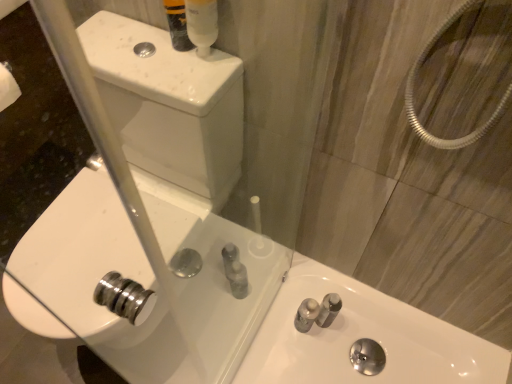
Find the location of `white glossy sink at lower right, the 2th sink when ordered from left to right`. white glossy sink at lower right, the 2th sink when ordered from left to right is located at coordinates (362, 337).

Which object is closer to the camera taking this photo, translucent plastic tube at upper center or translucent plastic mouthwash at upper center?

Positioned in front is translucent plastic mouthwash at upper center.

Are translucent plastic tube at upper center and translucent plastic mouthwash at upper center making contact?

Yes, the surface of translucent plastic tube at upper center is in contact with translucent plastic mouthwash at upper center.

Can you tell me how much translucent plastic tube at upper center and translucent plastic mouthwash at upper center differ in facing direction?

translucent plastic tube at upper center and translucent plastic mouthwash at upper center are facing 35.9 degrees away from each other.

Is translucent plastic tube at upper center aimed at translucent plastic mouthwash at upper center?

Yes, translucent plastic tube at upper center is facing translucent plastic mouthwash at upper center.

From the image's perspective, would you say translucent plastic tube at upper center is shown under white glossy sink at lower right, the 2th sink when ordered from left to right?

No.

Is white glossy sink at lower right, the first sink positioned from the right, at the back of translucent plastic tube at upper center?

No, translucent plastic tube at upper center's orientation is not away from white glossy sink at lower right, the first sink positioned from the right.

In terms of size, does translucent plastic tube at upper center appear bigger or smaller than white glossy sink at lower right, the first sink positioned from the right?

Considering their sizes, translucent plastic tube at upper center takes up less space than white glossy sink at lower right, the first sink positioned from the right.

In the image, is translucent plastic tube at upper center positioned in front of or behind white glossy sink at lower right, the first sink positioned from the right?

In the image, translucent plastic tube at upper center appears in front of white glossy sink at lower right, the first sink positioned from the right.

Measure the distance from translucent plastic mouthwash at upper center to translucent plastic tube at upper center.

They are 1.92 inches apart.

Which is in front, translucent plastic mouthwash at upper center or translucent plastic tube at upper center?

translucent plastic mouthwash at upper center is closer to the camera.

From the picture: Is translucent plastic mouthwash at upper center far away from translucent plastic tube at upper center?

translucent plastic mouthwash at upper center is actually quite close to translucent plastic tube at upper center.

From the image's perspective, is translucent plastic mouthwash at upper center over translucent plastic tube at upper center?

Actually, translucent plastic mouthwash at upper center appears below translucent plastic tube at upper center in the image.

From a real-world perspective, is white glossy sink at center, which is counted as the first sink, starting from the left, physically located above or below translucent plastic mouthwash at upper center?

In terms of real-world spatial position, white glossy sink at center, which is counted as the first sink, starting from the left, is below translucent plastic mouthwash at upper center.

Is white glossy sink at center, which is counted as the first sink, starting from the left, in front of translucent plastic mouthwash at upper center?

That is True.

Identify the location of sink that is on the left side of translucent plastic mouthwash at upper center. The image size is (512, 384). (147, 213).

Is point (154, 300) closer to camera compared to point (199, 54)?

No, (154, 300) is further to viewer.

Identify the location of sink above the white glossy sink at lower right, the 2th sink when ordered from left to right (from the image's perspective). The width and height of the screenshot is (512, 384). (147, 213).

Is white glossy sink at center, which is counted as the first sink, starting from the left, far away from white glossy sink at lower right, the first sink positioned from the right?

No.

Is white glossy sink at center, the 2th sink when ordered from right to left, closer to the viewer compared to white glossy sink at lower right, the first sink positioned from the right?

Yes, it is in front of white glossy sink at lower right, the first sink positioned from the right.

Is white glossy sink at lower right, the first sink positioned from the right, to the right of white glossy sink at center, the 2th sink when ordered from right to left, from the viewer's perspective?

Correct, you'll find white glossy sink at lower right, the first sink positioned from the right, to the right of white glossy sink at center, the 2th sink when ordered from right to left.

Looking at this image, from a real-world perspective, is white glossy sink at lower right, the first sink positioned from the right, physically above white glossy sink at center, the 2th sink when ordered from right to left?

No, from a real-world perspective, white glossy sink at lower right, the first sink positioned from the right, is not over white glossy sink at center, the 2th sink when ordered from right to left

Is white glossy sink at center, the 2th sink when ordered from right to left, inside white glossy sink at lower right, the 2th sink when ordered from left to right?

No, white glossy sink at center, the 2th sink when ordered from right to left, is located outside of white glossy sink at lower right, the 2th sink when ordered from left to right.

I want to click on sink below the white glossy sink at center, which is counted as the first sink, starting from the left (from the image's perspective), so click(x=362, y=337).

Is white glossy sink at lower right, the first sink positioned from the right, positioned beyond the bounds of translucent plastic tube at upper center?

Absolutely, white glossy sink at lower right, the first sink positioned from the right, is external to translucent plastic tube at upper center.

From the image's perspective, is white glossy sink at lower right, the first sink positioned from the right, above translucent plastic tube at upper center?

No, from the image's perspective, white glossy sink at lower right, the first sink positioned from the right, is not above translucent plastic tube at upper center.

Which object is thinner, white glossy sink at lower right, the 2th sink when ordered from left to right, or translucent plastic tube at upper center?

Thinner between the two is translucent plastic tube at upper center.

Which is in front, white glossy sink at lower right, the first sink positioned from the right, or translucent plastic tube at upper center?

translucent plastic tube at upper center is more forward.

Where is `mouthwash that appears below the translucent plastic tube at upper center (from the image's perspective)`? Image resolution: width=512 pixels, height=384 pixels. mouthwash that appears below the translucent plastic tube at upper center (from the image's perspective) is located at coordinates (202, 24).

The image size is (512, 384). I want to click on the 2nd sink directly beneath the translucent plastic tube at upper center (from a real-world perspective), so click(362, 337).

Estimate the real-world distances between objects in this image. Which object is further from translucent plastic tube at upper center, translucent plastic mouthwash at upper center or white glossy sink at lower right, the first sink positioned from the right?

white glossy sink at lower right, the first sink positioned from the right, lies further to translucent plastic tube at upper center than the other object.

From the picture: Which object lies further to the anchor point translucent plastic tube at upper center, white glossy sink at center, which is counted as the first sink, starting from the left, or translucent plastic mouthwash at upper center?

white glossy sink at center, which is counted as the first sink, starting from the left, is further to translucent plastic tube at upper center.

From the image, which object appears to be nearer to translucent plastic mouthwash at upper center, white glossy sink at lower right, the 2th sink when ordered from left to right, or white glossy sink at center, which is counted as the first sink, starting from the left?

The object closer to translucent plastic mouthwash at upper center is white glossy sink at center, which is counted as the first sink, starting from the left.

Based on their spatial positions, is white glossy sink at center, which is counted as the first sink, starting from the left, or translucent plastic mouthwash at upper center further from white glossy sink at lower right, the 2th sink when ordered from left to right?

Based on the image, translucent plastic mouthwash at upper center appears to be further to white glossy sink at lower right, the 2th sink when ordered from left to right.

Which object lies further to the anchor point white glossy sink at center, the 2th sink when ordered from right to left, translucent plastic tube at upper center or white glossy sink at lower right, the 2th sink when ordered from left to right?

The object further to white glossy sink at center, the 2th sink when ordered from right to left, is translucent plastic tube at upper center.

Looking at this image, looking at the image, which one is located further to translucent plastic mouthwash at upper center, translucent plastic tube at upper center or white glossy sink at lower right, the first sink positioned from the right?

white glossy sink at lower right, the first sink positioned from the right.

When comparing their distances from translucent plastic tube at upper center, does white glossy sink at center, which is counted as the first sink, starting from the left, or white glossy sink at lower right, the 2th sink when ordered from left to right, seem closer?

white glossy sink at center, which is counted as the first sink, starting from the left, is positioned closer to the anchor translucent plastic tube at upper center.

Which object lies further to the anchor point white glossy sink at center, which is counted as the first sink, starting from the left, translucent plastic tube at upper center or translucent plastic mouthwash at upper center?

Among the two, translucent plastic mouthwash at upper center is located further to white glossy sink at center, which is counted as the first sink, starting from the left.

This screenshot has height=384, width=512. What are the coordinates of `sink between translucent plastic tube at upper center and white glossy sink at lower right, the 2th sink when ordered from left to right, from top to bottom` in the screenshot? It's located at (147, 213).

Where is `mouthwash between translucent plastic tube at upper center and white glossy sink at center, which is counted as the first sink, starting from the left, in the vertical direction`? This screenshot has height=384, width=512. mouthwash between translucent plastic tube at upper center and white glossy sink at center, which is counted as the first sink, starting from the left, in the vertical direction is located at coordinates point(202,24).

Locate an element on the screen. This screenshot has height=384, width=512. mouthwash between translucent plastic tube at upper center and white glossy sink at lower right, the first sink positioned from the right, vertically is located at coordinates (202, 24).

Where is `sink between translucent plastic mouthwash at upper center and white glossy sink at lower right, the first sink positioned from the right, in the up-down direction`? The image size is (512, 384). sink between translucent plastic mouthwash at upper center and white glossy sink at lower right, the first sink positioned from the right, in the up-down direction is located at coordinates (147, 213).